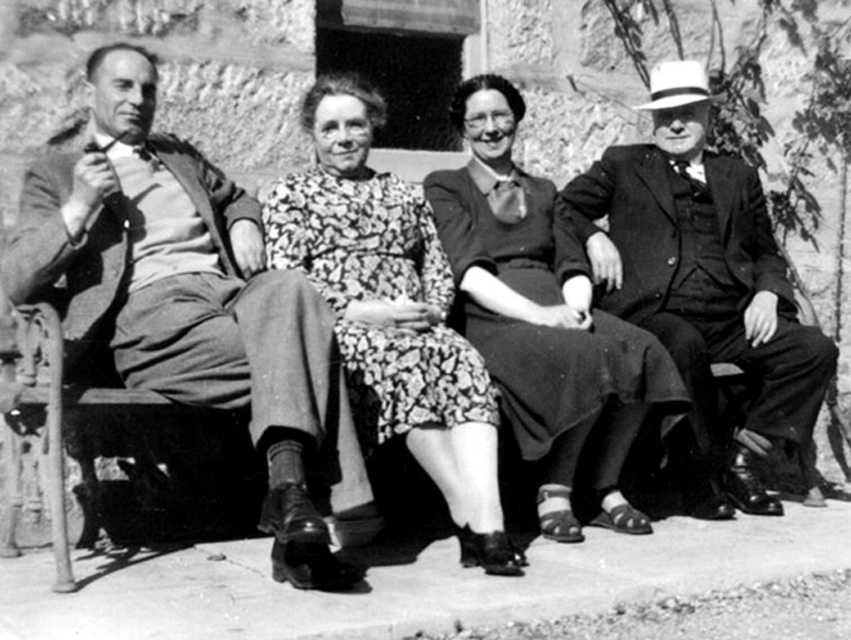
Question: Which point is closer to the camera taking this photo?

Choices:
 (A) (401, 288)
 (B) (293, 328)
 (C) (454, 272)

Answer: (B)

Question: Is matte black dress at center wider than floral dress at center?

Choices:
 (A) no
 (B) yes

Answer: (B)

Question: Does smooth fabric suit at left appear on the left side of matte black dress at center?

Choices:
 (A) yes
 (B) no

Answer: (A)

Question: Which object appears farthest from the camera in this image?

Choices:
 (A) smooth fabric suit at left
 (B) matte black dress at center
 (C) floral dress at center

Answer: (B)

Question: Which point is closer to the camera?

Choices:
 (A) floral dress at center
 (B) smooth fabric suit at left
 (C) matte black dress at center

Answer: (B)

Question: Is smooth black suit at right above floral dress at center?

Choices:
 (A) no
 (B) yes

Answer: (B)